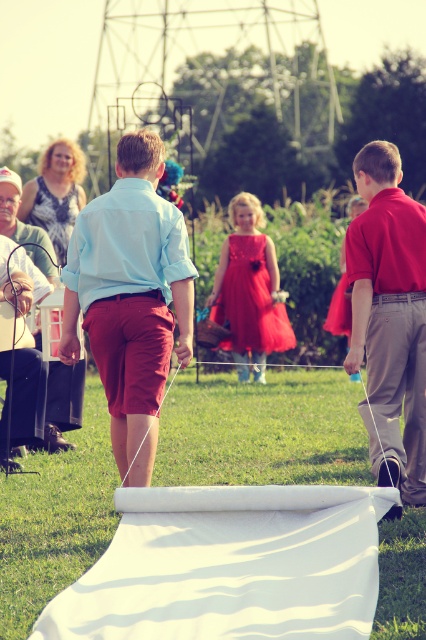
You are a photographer at a wedding ceremony. You notice a white string at center and a shiny taffeta dress at center in the frame. Which object is positioned lower in the image?

The white string at center is positioned lower than the shiny taffeta dress at center.

You are a photographer trying to capture a photo of the light blue cotton shirt at center and the white string at center. Since you want both subjects to be in focus, you need to know their positions relative to each other. Based on the scene, which object is positioned to the left?

The light blue cotton shirt at center is to the left of the white string at center, so the light blue cotton shirt at center is positioned to the left.